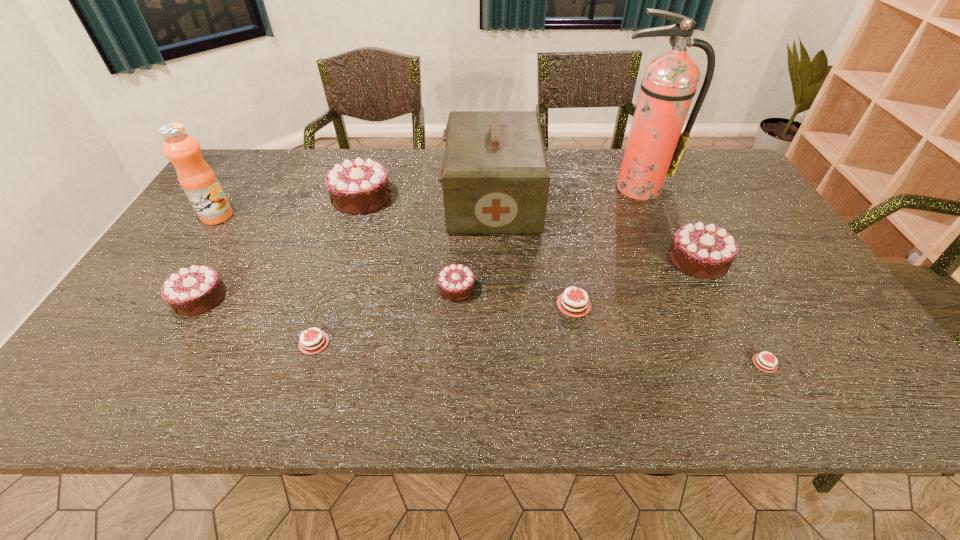
You are a GUI agent. You are given a task and a screenshot of the screen. Output one action in this format:
    pyautogui.click(x=<x>, y=<y>)
    Task: Click on the chocolate cake present at the far edge
    This screenshot has width=960, height=540.
    Given the screenshot: What is the action you would take?
    pyautogui.click(x=658, y=376)

You are a GUI agent. You are given a task and a screenshot of the screen. Output one action in this format:
    pyautogui.click(x=<x>, y=<y>)
    Task: Click on the fruit juice located in the left edge section of the desktop
    This screenshot has height=540, width=960.
    Given the screenshot: What is the action you would take?
    coord(658,376)

Where is `chocolate cake present at the left edge`? The height and width of the screenshot is (540, 960). chocolate cake present at the left edge is located at coordinates (170, 346).

In the image, there is a desktop. Find the location of `vacant space at the far edge`. vacant space at the far edge is located at coordinates (522, 162).

Find the location of a particular element. object that stands as the sixth closest to the fruit juice is located at coordinates (658, 376).

Locate which object ranks ninth in proximity to the fruit juice. Please provide its 2D coordinates. Your answer should be formatted as a tuple, i.e. [(x, y)], where the tuple contains the x and y coordinates of a point satisfying the conditions above.

[(658, 376)]

At what (x,y) coordinates should I click in order to perform the action: click on chocolate cake that stands as the second closest to the fruit juice. Please return your answer as a coordinate pair (x, y). Looking at the image, I should click on (658, 376).

This screenshot has width=960, height=540. Find the location of `chocolate cake that stands as the second closest to the fruit juice`. chocolate cake that stands as the second closest to the fruit juice is located at coordinates (658, 376).

At what (x,y) coordinates should I click in order to perform the action: click on chocolate chocolate cake that stands as the second closest to the fourth tallest object. Please return your answer as a coordinate pair (x, y). Looking at the image, I should click on (170, 346).

Where is `chocolate chocolate cake that is the second closest to the leftmost red chocolate cake`? chocolate chocolate cake that is the second closest to the leftmost red chocolate cake is located at coordinates (444, 353).